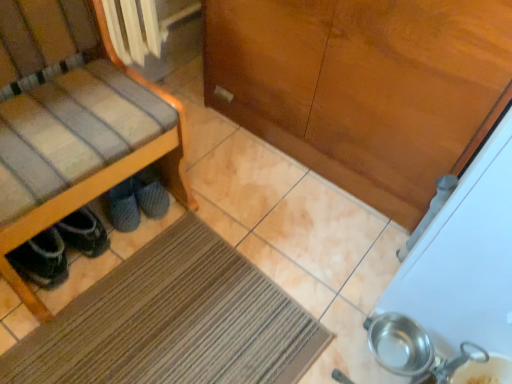
Question: Is gray fuzzy slippers at lower left, which is the 2th footwear from front to back, to the left or to the right of dark gray suede shoes under chair left, which ranks as the 2th footwear in right-to-left order, in the image?

Choices:
 (A) left
 (B) right

Answer: (B)

Question: Considering the positions of point (117, 203) and point (82, 231), is point (117, 203) closer or farther from the camera than point (82, 231)?

Choices:
 (A) closer
 (B) farther

Answer: (B)

Question: Considering the real-world distances, which object is farthest from the gray fuzzy slippers at lower left, which is the 1th footwear in back-to-front order?

Choices:
 (A) wooden chair at left
 (B) dark gray suede shoes under chair left, positioned as the first footwear in left-to-right order
 (C) brown textured mat at lower center
 (D) wooden cabinet at center

Answer: (D)

Question: Which of these objects is positioned closest to the brown textured mat at lower center?

Choices:
 (A) gray fuzzy slippers at lower left, which is the 2th footwear from front to back
 (B) dark gray suede shoes under chair left, acting as the 2th footwear starting from the back
 (C) wooden chair at left
 (D) wooden cabinet at center

Answer: (B)